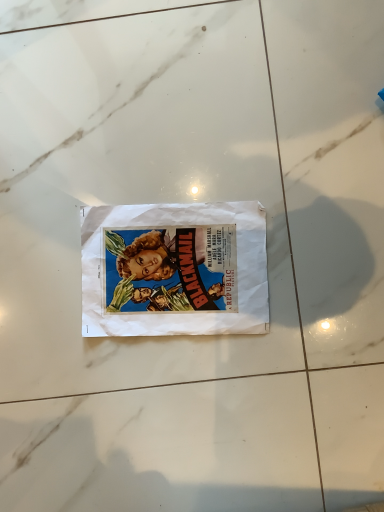
This screenshot has width=384, height=512. What do you see at coordinates (175, 269) in the screenshot?
I see `matte paper poster at center` at bounding box center [175, 269].

The width and height of the screenshot is (384, 512). I want to click on matte paper poster at center, so click(x=175, y=269).

Where is `matte paper poster at center`? The width and height of the screenshot is (384, 512). matte paper poster at center is located at coordinates (175, 269).